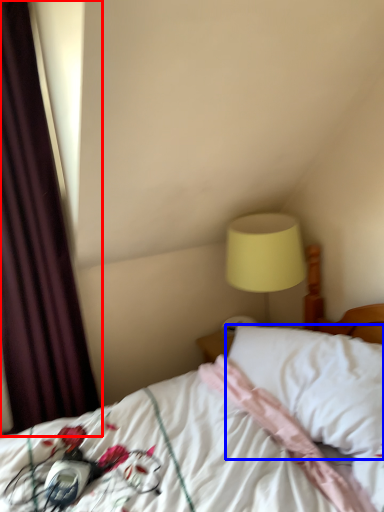
Question: Which of the following is the closest to the observer, curtain (highlighted by a red box) or pillow (highlighted by a blue box)?

Choices:
 (A) curtain
 (B) pillow

Answer: (B)